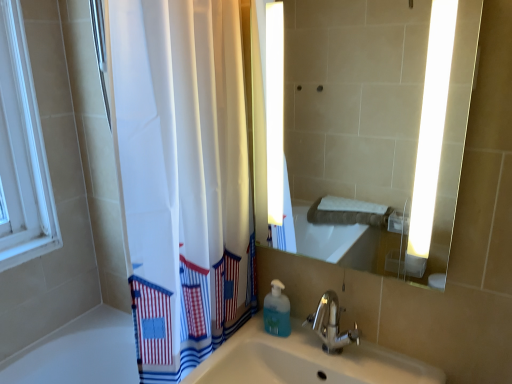
Question: Should I look upward or downward to see blue translucent soap dispenser at lower center?

Choices:
 (A) down
 (B) up

Answer: (A)

Question: Can you confirm if chrome metallic faucet at center is thinner than matte glass mirror at center?

Choices:
 (A) yes
 (B) no

Answer: (B)

Question: Is chrome metallic faucet at center further to the viewer compared to matte glass mirror at center?

Choices:
 (A) no
 (B) yes

Answer: (B)

Question: Considering the relative positions of chrome metallic faucet at center and matte glass mirror at center in the image provided, is chrome metallic faucet at center in front of matte glass mirror at center?

Choices:
 (A) no
 (B) yes

Answer: (A)

Question: Is matte glass mirror at center at the back of chrome metallic faucet at center?

Choices:
 (A) no
 (B) yes

Answer: (A)

Question: Does chrome metallic faucet at center have a larger size compared to matte glass mirror at center?

Choices:
 (A) no
 (B) yes

Answer: (A)

Question: Is matte glass mirror at center a part of chrome metallic faucet at center?

Choices:
 (A) no
 (B) yes

Answer: (A)

Question: Is chrome metallic faucet at center located outside blue translucent soap dispenser at lower center?

Choices:
 (A) no
 (B) yes

Answer: (B)

Question: Does chrome metallic faucet at center have a smaller size compared to blue translucent soap dispenser at lower center?

Choices:
 (A) yes
 (B) no

Answer: (B)

Question: Considering the relative sizes of chrome metallic faucet at center and blue translucent soap dispenser at lower center in the image provided, is chrome metallic faucet at center shorter than blue translucent soap dispenser at lower center?

Choices:
 (A) no
 (B) yes

Answer: (A)

Question: Is chrome metallic faucet at center positioned behind blue translucent soap dispenser at lower center?

Choices:
 (A) no
 (B) yes

Answer: (A)

Question: Does chrome metallic faucet at center have a greater width compared to blue translucent soap dispenser at lower center?

Choices:
 (A) no
 (B) yes

Answer: (B)

Question: Is chrome metallic faucet at center looking in the opposite direction of blue translucent soap dispenser at lower center?

Choices:
 (A) yes
 (B) no

Answer: (B)

Question: Can you confirm if matte glass mirror at center is positioned to the left of blue translucent soap dispenser at lower center?

Choices:
 (A) yes
 (B) no

Answer: (B)